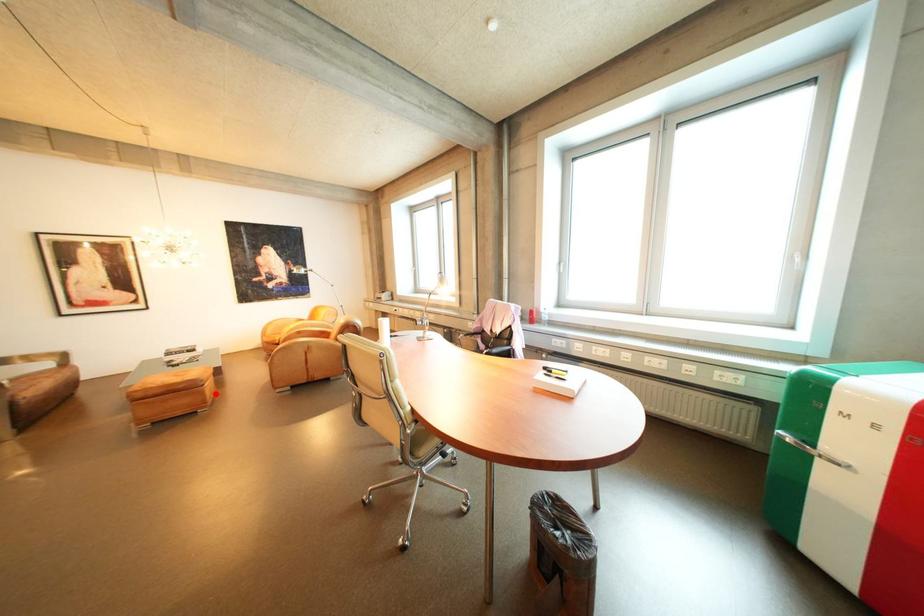
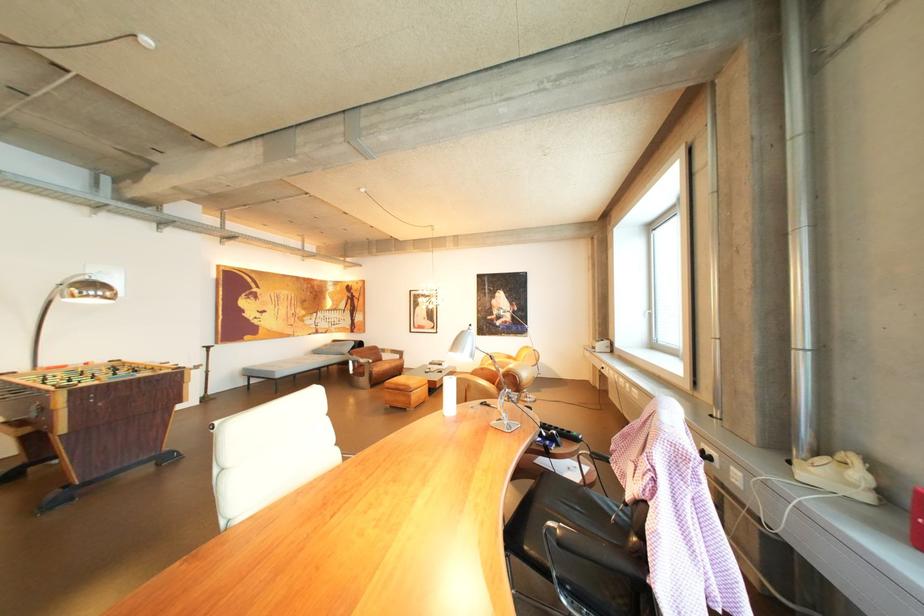
Question: I am providing you with two images of the same scene from different viewpoints. A red point is marked on the first image. Is the red point's position out of view in image 2?

Choices:
 (A) Yes
 (B) No

Answer: (B)